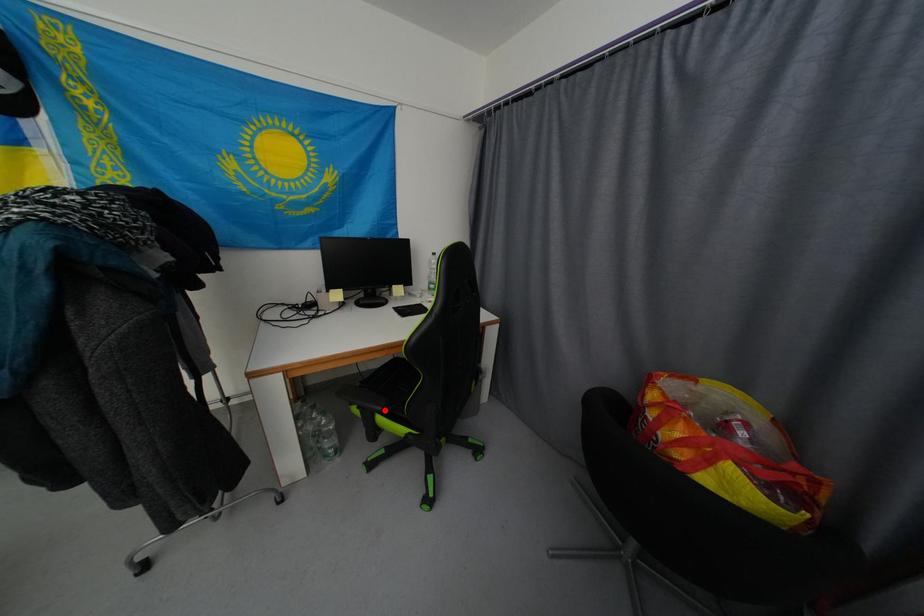
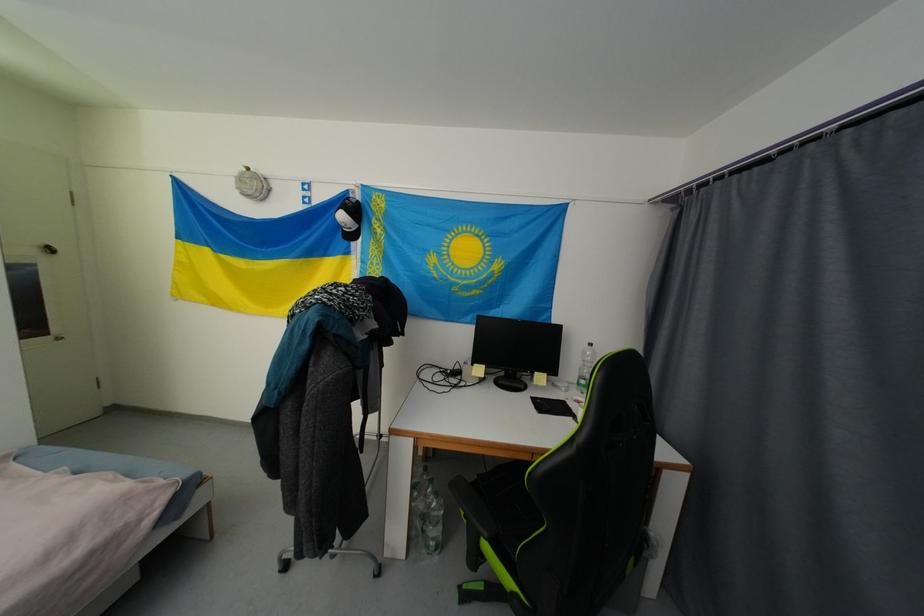
Question: I am providing you with two images of the same scene from different viewpoints. Given a red point in image1, look at the same physical point in image2. Is it:

Choices:
 (A) Closer to the viewpoint
 (B) Farther from the viewpoint

Answer: (B)